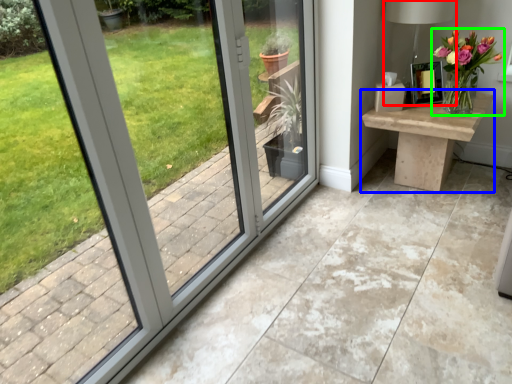
Question: Which is nearer to the table lamp (highlighted by a red box)? table (highlighted by a blue box) or houseplant (highlighted by a green box).

Choices:
 (A) table
 (B) houseplant

Answer: (B)